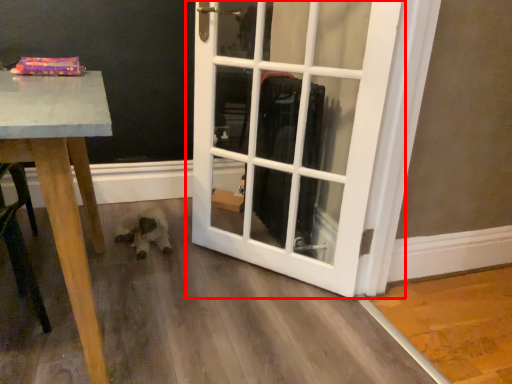
Question: Considering the relative positions of door (annotated by the red box) and animal in the image provided, where is door (annotated by the red box) located with respect to the staircase?

Choices:
 (A) right
 (B) left

Answer: (A)